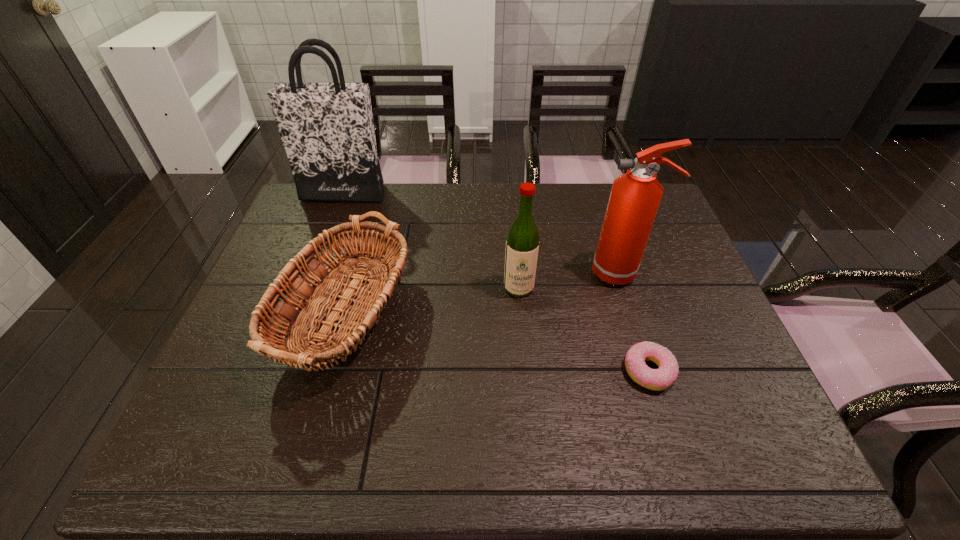
Where is `blank space located at the nozzle of the second tallest object`? The width and height of the screenshot is (960, 540). blank space located at the nozzle of the second tallest object is located at coordinates (449, 273).

Locate an element on the screen. vacant position located on the label of the third tallest object is located at coordinates tap(532, 436).

I want to click on vacant area located on the back of the fourth tallest object, so click(368, 212).

The height and width of the screenshot is (540, 960). Find the location of `vacant space located 0.350m on the back of the shortest object`. vacant space located 0.350m on the back of the shortest object is located at coordinates (612, 252).

This screenshot has height=540, width=960. I want to click on object located in the far edge section of the desktop, so click(327, 129).

Identify the location of object that is at the near edge. (370, 299).

Find the location of `shopping bag located in the left edge section of the desktop`. shopping bag located in the left edge section of the desktop is located at coordinates (327, 129).

The width and height of the screenshot is (960, 540). I want to click on basket at the left edge, so click(x=370, y=299).

The width and height of the screenshot is (960, 540). In order to click on object positioned at the right edge in this screenshot , I will do `click(635, 196)`.

Locate an element on the screen. object at the far left corner is located at coordinates (327, 129).